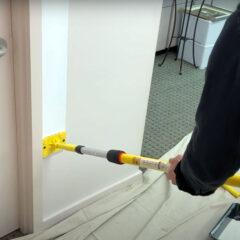
This screenshot has width=240, height=240. I want to click on empty space right of white paint, so click(103, 44).